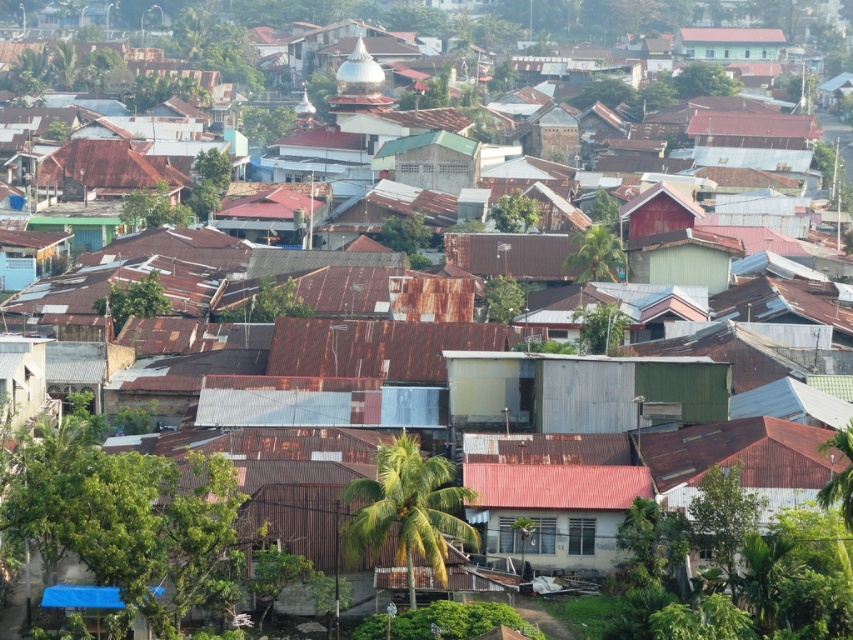
Is rusty metal hut at upper left shorter than green corrugated metal building at upper center?

Incorrect, rusty metal hut at upper left's height does not fall short of green corrugated metal building at upper center's.

In the scene shown: Which is more to the right, rusty metal hut at upper left or green corrugated metal building at upper center?

green corrugated metal building at upper center is more to the right.

Is point (82, 186) behind point (679, 48)?

That is False.

Identify the location of rusty metal hut at upper left. This screenshot has height=640, width=853. (105, 172).

Who is positioned more to the left, green corrugated metal hut at center or rusty metal hut at upper left?

rusty metal hut at upper left is more to the left.

Is point (457, 403) closer to camera compared to point (169, 170)?

Yes, point (457, 403) is in front of point (169, 170).

Is point (502, 369) positioned behind point (70, 152)?

No, it is not.

Where is `green corrugated metal hut at center`? This screenshot has height=640, width=853. green corrugated metal hut at center is located at coordinates tap(582, 390).

Between point (454, 380) and point (758, 35), which one is positioned behind?

The point (758, 35) is behind.

What do you see at coordinates (582, 390) in the screenshot? Image resolution: width=853 pixels, height=640 pixels. I see `green corrugated metal hut at center` at bounding box center [582, 390].

Find the location of `green corrugated metal hut at center`. green corrugated metal hut at center is located at coordinates tap(582, 390).

The height and width of the screenshot is (640, 853). What are the coordinates of `green corrugated metal hut at center` in the screenshot? It's located at (582, 390).